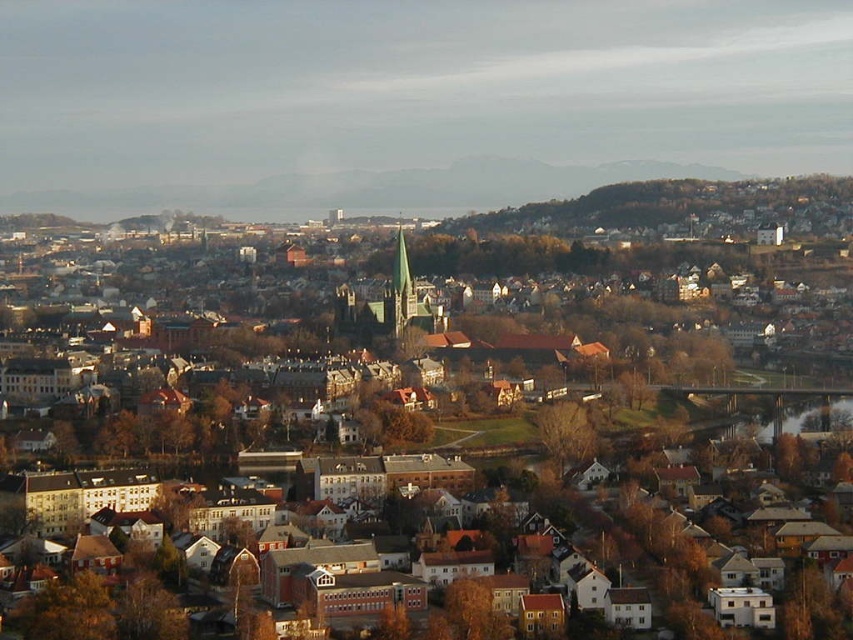
Question: Is brown wooden houses at center smaller than brown textured tree at lower left?

Choices:
 (A) yes
 (B) no

Answer: (B)

Question: Does brown wooden houses at center have a larger size compared to brown leafy tree at center?

Choices:
 (A) no
 (B) yes

Answer: (B)

Question: Which of the following is the closest to the observer?

Choices:
 (A) (717, 368)
 (B) (413, 324)
 (C) (109, 627)

Answer: (C)

Question: Which object is the closest to the brown textured tree at lower left?

Choices:
 (A) brown wooden houses at center
 (B) green stone spire at center
 (C) green stone church steeple at center
 (D) brown leafy tree at center

Answer: (D)

Question: Which of the following is the closest to the observer?

Choices:
 (A) green stone church steeple at center
 (B) brown leafy tree at center
 (C) brown wooden houses at center

Answer: (C)

Question: In this image, where is green stone church steeple at center located relative to brown leafy tree at center?

Choices:
 (A) above
 (B) below

Answer: (A)